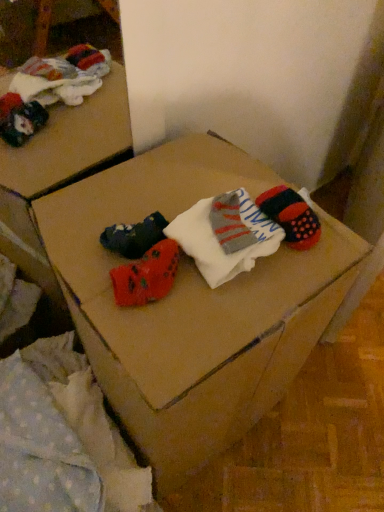
The height and width of the screenshot is (512, 384). Find the location of `vacant area that is in front of white soft socks at center`. vacant area that is in front of white soft socks at center is located at coordinates (211, 327).